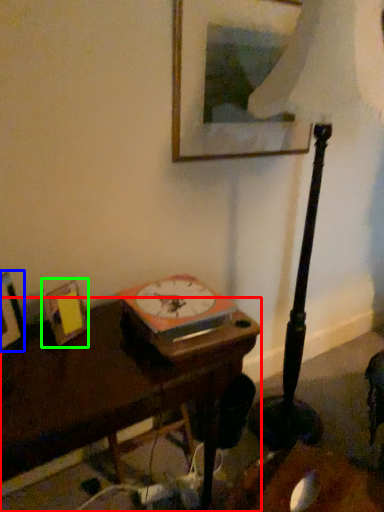
Question: Which object is positioned farthest from table (highlighted by a red box)? Select from picture frame (highlighted by a blue box) and picture frame (highlighted by a green box).

Choices:
 (A) picture frame
 (B) picture frame

Answer: (A)